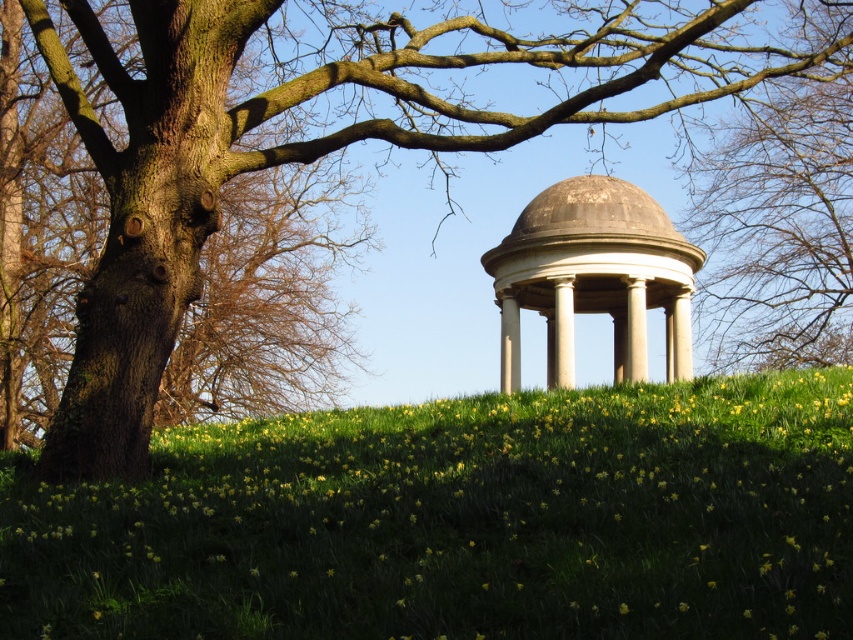
You are standing at the base of the hill and want to reach the stone gazebo at center. According to the scene, which direction should you move relative to the green grassy hillside at center to get there?

The stone gazebo at center is above the green grassy hillside at center, so you should move upward towards the stone gazebo at center to reach it.

Looking at this image, you are a landscape architect designing a new garden. You need to place a small statue between the green grassy hillside at center and the brown rough tree at upper center. Which area has more space available for placement?

The brown rough tree at upper center occupies more space than the green grassy hillside at center, so placing the statue there would have more space available.

You are standing at the base of the hill and want to reach the classical pavilion located on the green grassy hillside at center. If your average walking speed is 1.5 meters per second, how many seconds will it take you to reach the pavilion?

The distance between the green grassy hillside at center and the viewer is 6.82 meters. At a walking speed of 1.5 meters per second, it would take approximately 4.55 seconds to reach the pavilion. Since you can round to the nearest whole number, it would take about 5 seconds.